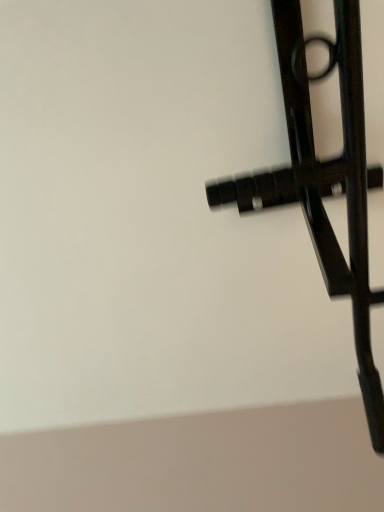
You are a GUI agent. You are given a task and a screenshot of the screen. Output one action in this format:
    pyautogui.click(x=<x>, y=<y>)
    Task: Click on the black matte tripod at upper right
    The height and width of the screenshot is (512, 384).
    Given the screenshot: What is the action you would take?
    pyautogui.click(x=324, y=179)

The width and height of the screenshot is (384, 512). Describe the element at coordinates (324, 179) in the screenshot. I see `black matte tripod at upper right` at that location.

In order to face black matte tripod at upper right, should I rotate leftwards or rightwards?

Rotate your view right by about 16.798°.

Locate an element on the screen. black matte tripod at upper right is located at coordinates (324, 179).